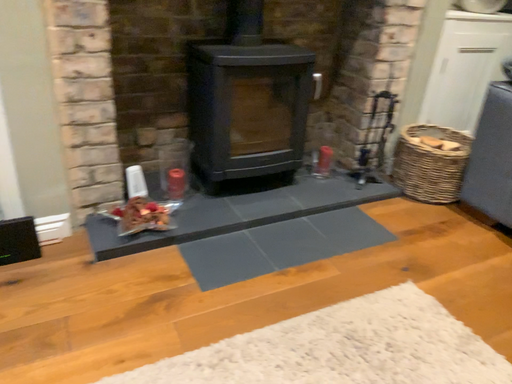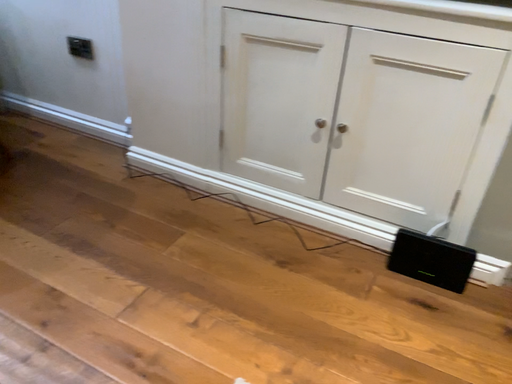
Question: Which way did the camera rotate in the video?

Choices:
 (A) rotated right
 (B) rotated left

Answer: (B)